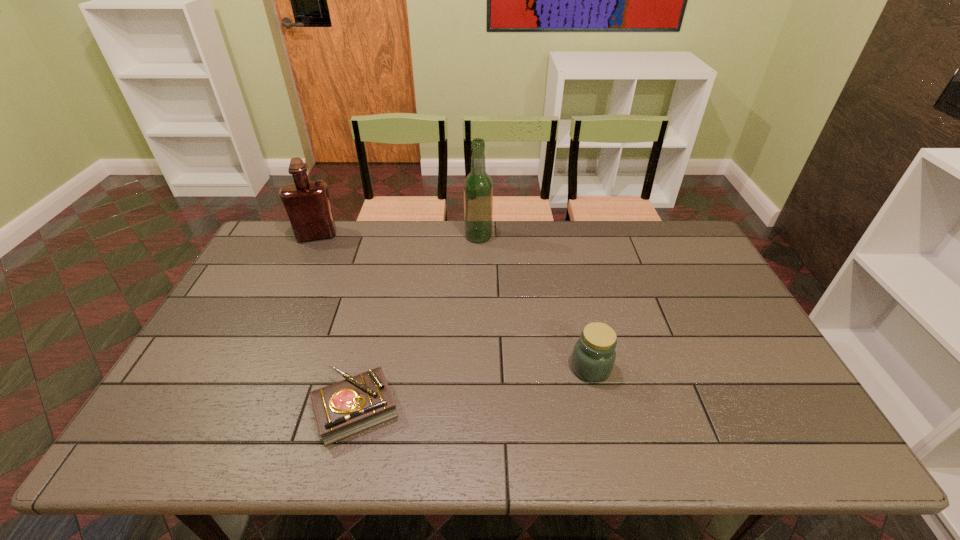
Locate an element on the screen. Image resolution: width=960 pixels, height=540 pixels. free space located 0.050m on the left of the rightmost object is located at coordinates (551, 368).

I want to click on vacant space positioned on the back of the diary, so click(x=384, y=292).

Where is `object that is at the near edge`? object that is at the near edge is located at coordinates (350, 406).

Locate an element on the screen. The height and width of the screenshot is (540, 960). object positioned at the left edge is located at coordinates (x=307, y=203).

Where is `object at the far left corner`? object at the far left corner is located at coordinates (307, 203).

Identify the location of vacant area at the far edge of the desktop. Image resolution: width=960 pixels, height=540 pixels. (614, 241).

Identify the location of vacant space at the near edge of the desktop. (258, 444).

Identify the location of free space at the left edge of the desktop. (212, 343).

Identify the location of free region at the right edge of the desktop. The height and width of the screenshot is (540, 960). (805, 417).

This screenshot has width=960, height=540. In the image, there is a desktop. What are the coordinates of `vacant space at the near left corner` in the screenshot? It's located at (190, 422).